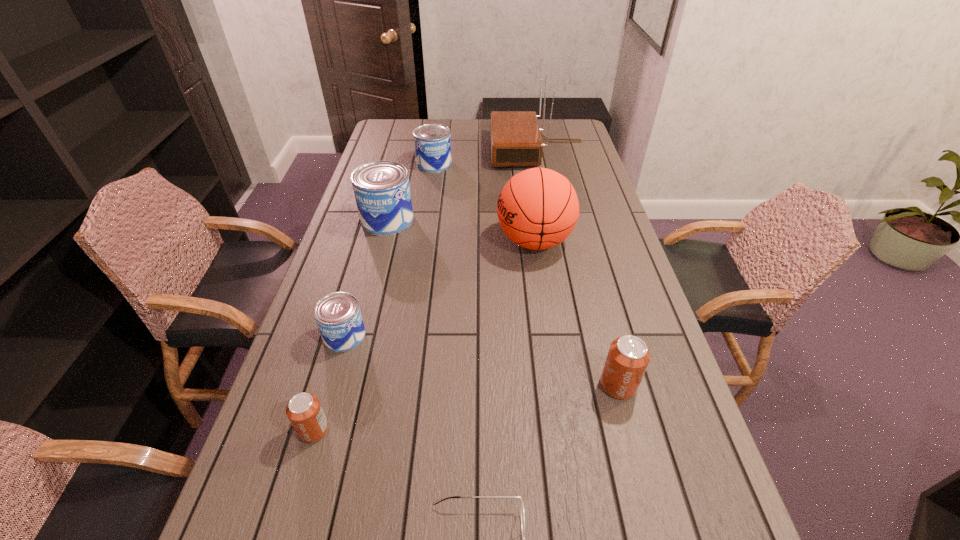
In order to click on blank space at the right edge of the desktop in this screenshot , I will do `click(615, 289)`.

This screenshot has height=540, width=960. What are the coordinates of `vacant area that lies between the farthest blue can and the second nearest can` in the screenshot? It's located at (526, 274).

You are a GUI agent. You are given a task and a screenshot of the screen. Output one action in this format:
    pyautogui.click(x=<x>, y=<y>)
    Task: Click on the vacant space that's between the nearest can and the sixth farthest object
    
    Given the screenshot: What is the action you would take?
    pyautogui.click(x=466, y=408)

Where is `vacant area between the third nearest can and the basketball`? The image size is (960, 540). vacant area between the third nearest can and the basketball is located at coordinates (440, 288).

Where is `vacant area that lies between the second biggest blue can and the biggest blue can`? This screenshot has height=540, width=960. vacant area that lies between the second biggest blue can and the biggest blue can is located at coordinates (411, 192).

Where is `unoccupied position between the right orange can and the radio_receiver`? This screenshot has width=960, height=540. unoccupied position between the right orange can and the radio_receiver is located at coordinates (578, 268).

Locate an element on the screen. This screenshot has height=540, width=960. free space between the smaller orange can and the radio_receiver is located at coordinates (426, 290).

Find the location of `free area in between the nearer orange can and the rightmost can`. free area in between the nearer orange can and the rightmost can is located at coordinates [466, 408].

Locate an element on the screen. free space between the biggest blue can and the third nearest object is located at coordinates (503, 302).

Identify the location of object that can be found as the second closest to the spectacles. (628, 357).